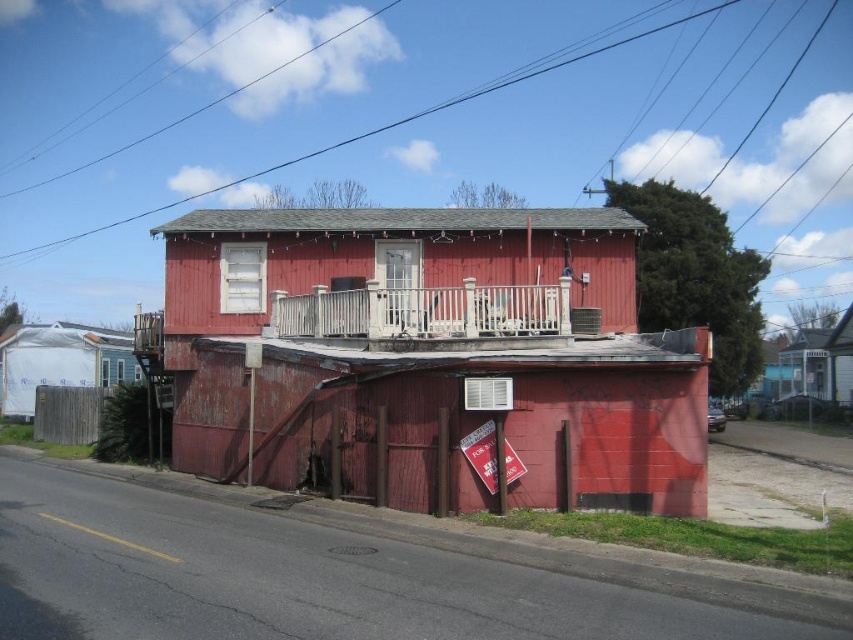
Question: Observing the image, what is the correct spatial positioning of rusty wood hut at center in reference to white plastic tarp at left?

Choices:
 (A) below
 (B) above

Answer: (B)

Question: Does rusty wood hut at center have a larger size compared to white plastic tarp at left?

Choices:
 (A) yes
 (B) no

Answer: (A)

Question: Is rusty wood hut at center behind white plastic tarp at left?

Choices:
 (A) no
 (B) yes

Answer: (A)

Question: Among these points, which one is farthest from the camera?

Choices:
 (A) pyautogui.click(x=20, y=410)
 (B) pyautogui.click(x=202, y=288)

Answer: (A)